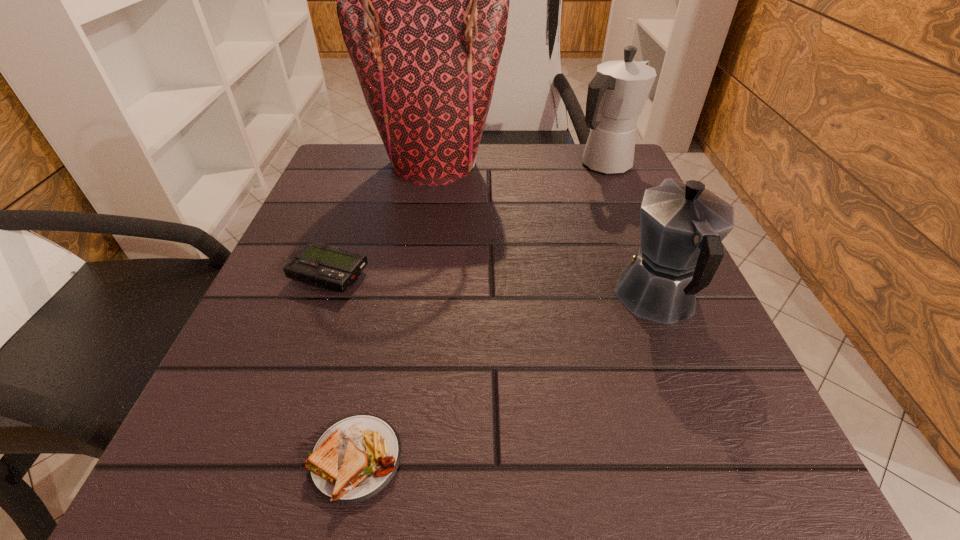
Where is `handbag`? Image resolution: width=960 pixels, height=540 pixels. handbag is located at coordinates pos(422,0).

Where is `the taller coffeepot`? The height and width of the screenshot is (540, 960). the taller coffeepot is located at coordinates (616, 95).

Identify the location of the fourth shortest object. (616, 95).

I want to click on the nearer coffeepot, so pyautogui.click(x=682, y=226).

Locate an element on the screen. This screenshot has height=540, width=960. the shorter coffeepot is located at coordinates (682, 226).

The width and height of the screenshot is (960, 540). I want to click on beeper, so click(x=326, y=266).

Where is `sandwich`? sandwich is located at coordinates (355, 458).

The height and width of the screenshot is (540, 960). In order to click on the shortest object in this screenshot , I will do `click(355, 458)`.

Where is `vacant space located 0.240m on the right of the tallest object`? vacant space located 0.240m on the right of the tallest object is located at coordinates (609, 163).

Find the location of a particular element. vacant space located 0.080m on the left of the taller coffeepot is located at coordinates pyautogui.click(x=535, y=166).